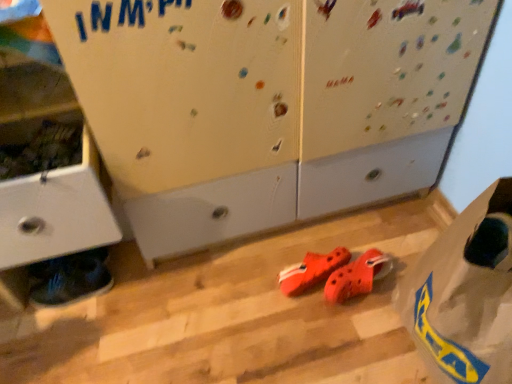
The height and width of the screenshot is (384, 512). Find the location of `vacant space in between matte white cabinet at left and rubber/crocodile-patterned shoes at center, the 2th footwear positioned from the left`. vacant space in between matte white cabinet at left and rubber/crocodile-patterned shoes at center, the 2th footwear positioned from the left is located at coordinates (203, 282).